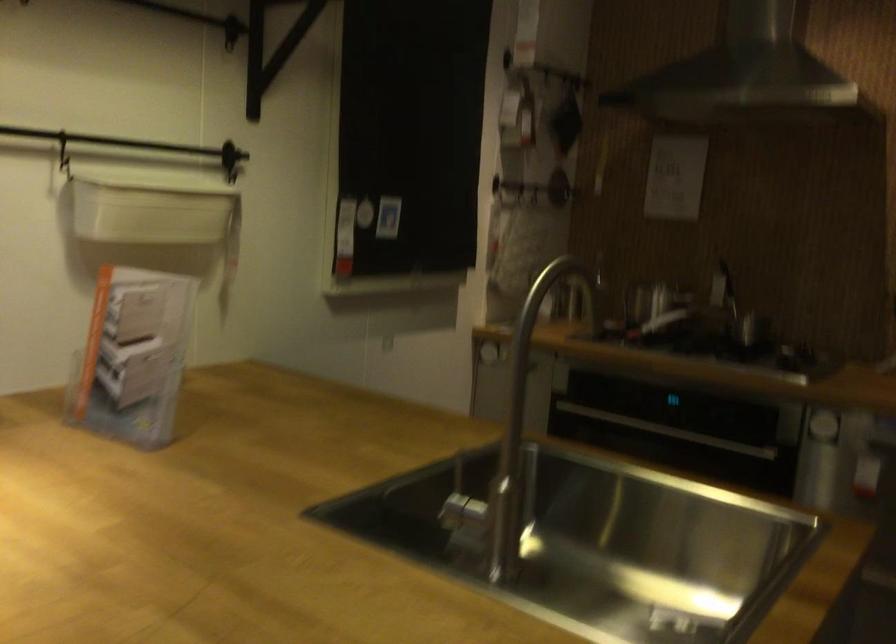
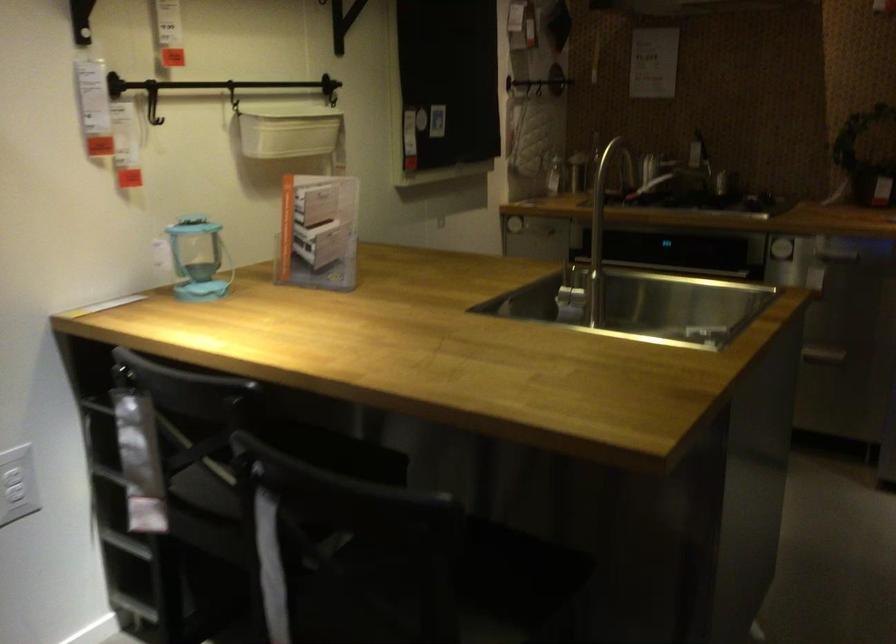
Where in the second image is the point corresponding to point 143,353 from the first image?

(317, 232)